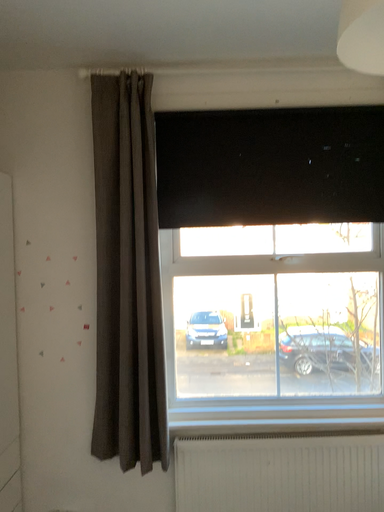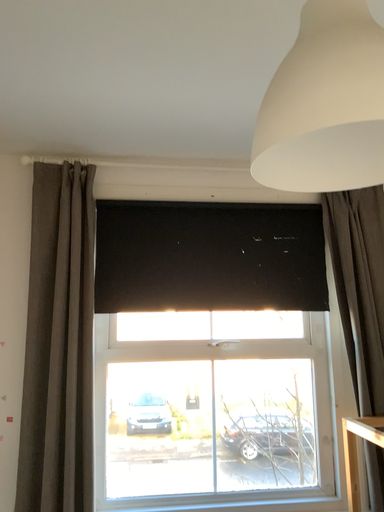
Question: How did the camera likely rotate when shooting the video?

Choices:
 (A) rotated upward
 (B) rotated downward

Answer: (A)